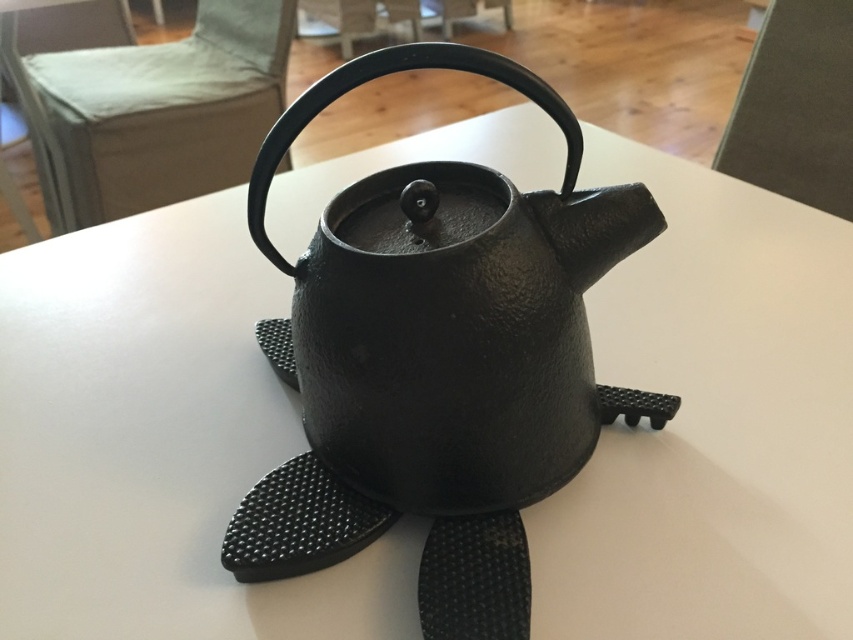
Question: In this image, where is matte black teapot at center located relative to black cast iron teapot at center?

Choices:
 (A) left
 (B) right

Answer: (B)

Question: Can you confirm if matte black teapot at center is positioned to the right of black cast iron teapot at center?

Choices:
 (A) yes
 (B) no

Answer: (A)

Question: Is matte black teapot at center above black cast iron teapot at center?

Choices:
 (A) no
 (B) yes

Answer: (A)